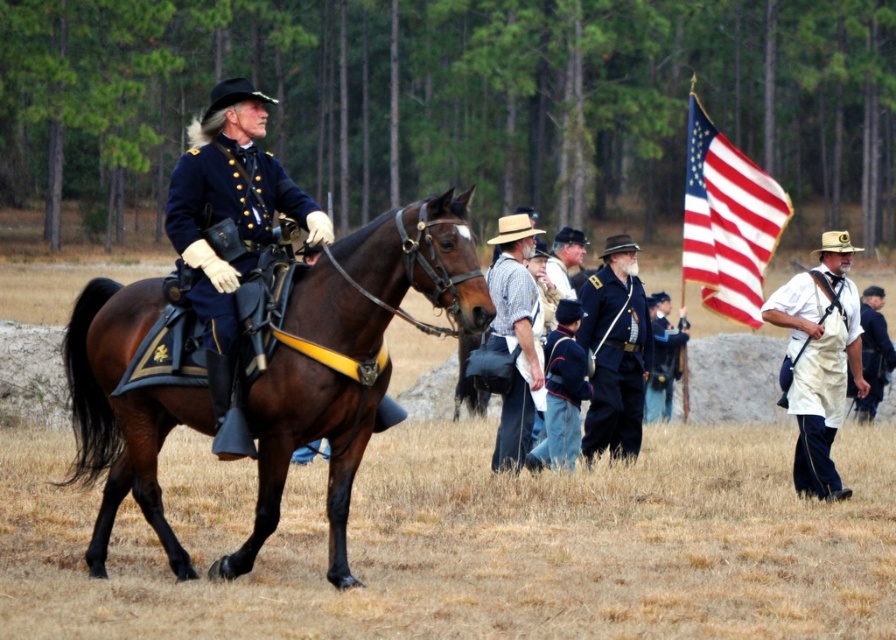
Who is taller, matte blue uniform at center or blue cotton shirt at center?

With more height is matte blue uniform at center.

Does point (224, 346) lie behind point (643, 397)?

No, (224, 346) is closer to viewer.

At what (x,y) coordinates should I click in order to perform the action: click on matte blue uniform at center. Please return your answer as a coordinate pair (x, y). Looking at the image, I should click on (230, 232).

Which is below, brown glossy horse at left or white striped shirt at center?

Positioned lower is brown glossy horse at left.

Is point (112, 516) positioned after point (522, 456)?

No, it is not.

Who is more forward, [366,440] or [515,253]?

Point [366,440] is more forward.

Identify the location of brown glossy horse at left. (351, 355).

Who is taller, matte blue uniform at center or white cotton shirt at right?

Standing taller between the two is matte blue uniform at center.

Can you confirm if matte blue uniform at center is smaller than white cotton shirt at right?

Incorrect, matte blue uniform at center is not smaller in size than white cotton shirt at right.

Looking at this image, measure the distance between matte blue uniform at center and camera.

A distance of 9.75 meters exists between matte blue uniform at center and camera.

You are a GUI agent. You are given a task and a screenshot of the screen. Output one action in this format:
    pyautogui.click(x=<x>, y=<y>)
    Task: Click on the matte blue uniform at center
    
    Given the screenshot: What is the action you would take?
    pyautogui.click(x=230, y=232)